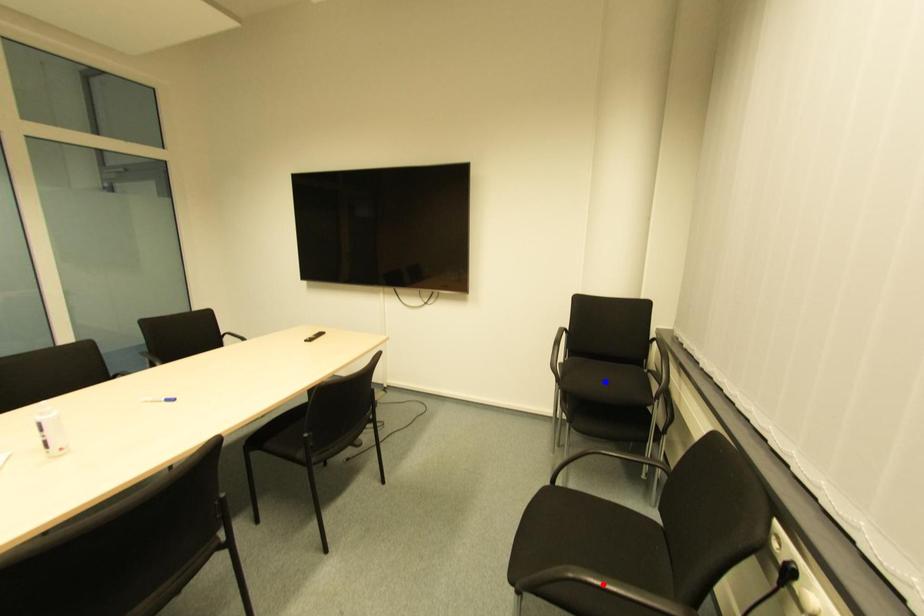
Question: Which of the two points in the image is closer to the camera?

Choices:
 (A) Blue point is closer.
 (B) Red point is closer.

Answer: (B)